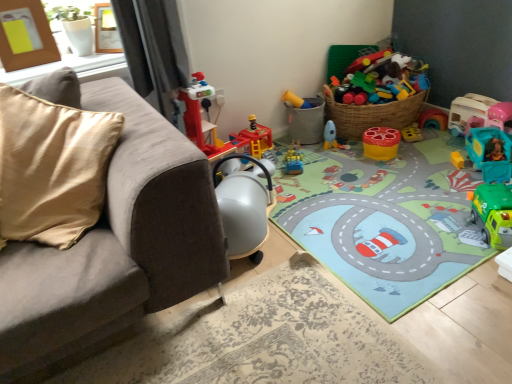
Find the location of a particular element. vacant point to the left of yellow matte stool at center, placed as the fourth toy when sorted from right to left is located at coordinates (349, 155).